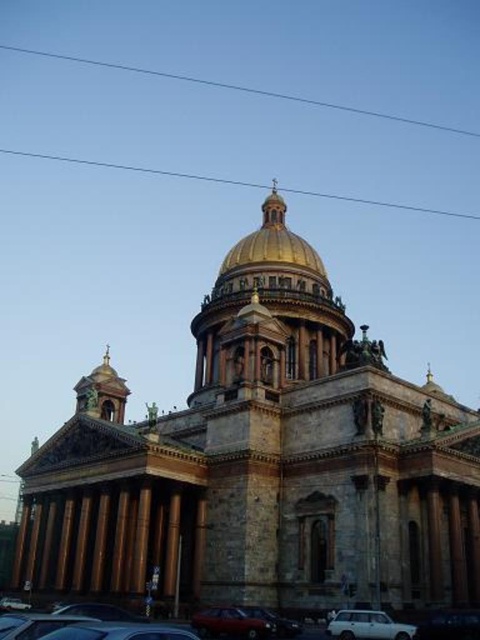
This screenshot has height=640, width=480. Identify the location of clear blue wire at upper center. (239, 88).

Does point (254, 92) come farther from viewer compared to point (19, 620)?

Yes, point (254, 92) is behind point (19, 620).

Identify the location of clear blue wire at upper center. (239, 88).

Between point (79, 627) and point (351, 616), which one is positioned in front?

Point (79, 627) is more forward.

Can you confirm if metallic silver car at lower center is positioned to the right of white matte car at lower center?

No, metallic silver car at lower center is not to the right of white matte car at lower center.

Does point (167, 630) lie behind point (360, 636)?

No, (167, 630) is closer to viewer.

At what (x,y) coordinates should I click in order to perform the action: click on metallic silver car at lower center. Please return your answer as a coordinate pair (x, y). The height and width of the screenshot is (640, 480). Looking at the image, I should click on [x=119, y=632].

Is metallic silver car at lower center smaller than metallic silver car at lower left?

Correct, metallic silver car at lower center occupies less space than metallic silver car at lower left.

Is metallic silver car at lower center further to the viewer compared to metallic silver car at lower left?

No, it is not.

Is point (157, 630) farther from camera compared to point (60, 614)?

No, it is in front of (60, 614).

Where is `metallic silver car at lower center`? This screenshot has width=480, height=640. metallic silver car at lower center is located at coordinates (119, 632).